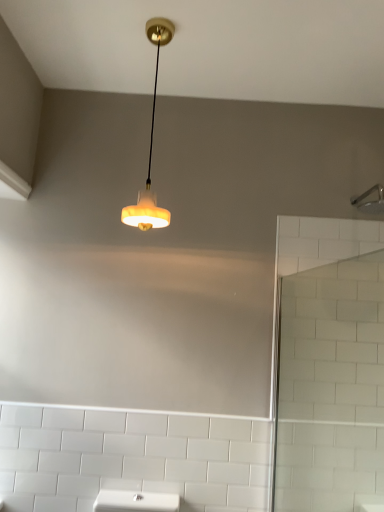
I want to click on silver metallic shower head at upper right, so click(x=370, y=201).

Does point (377, 213) lie behind point (151, 21)?

Yes.

Considering the relative sizes of silver metallic shower head at upper right and matte white lampshade at upper center in the image provided, is silver metallic shower head at upper right wider than matte white lampshade at upper center?

Yes, silver metallic shower head at upper right is wider than matte white lampshade at upper center.

Can you confirm if silver metallic shower head at upper right is positioned to the left of matte white lampshade at upper center?

In fact, silver metallic shower head at upper right is to the right of matte white lampshade at upper center.

Considering the relative sizes of matte white lampshade at upper center and white glass screen door at right in the image provided, is matte white lampshade at upper center shorter than white glass screen door at right?

Yes, matte white lampshade at upper center is shorter than white glass screen door at right.

The image size is (384, 512). Find the location of `lamp on the left of the white glass screen door at right`. lamp on the left of the white glass screen door at right is located at coordinates (151, 146).

Considering the positions of objects matte white lampshade at upper center and white glass screen door at right in the image provided, who is in front, matte white lampshade at upper center or white glass screen door at right?

white glass screen door at right is in front.

Is matte white lampshade at upper center beside white glass screen door at right?

No.

From a real-world perspective, is white glass screen door at right physically located above or below silver metallic shower head at upper right?

Clearly, from a real-world perspective, white glass screen door at right is below silver metallic shower head at upper right.

Is white glass screen door at right inside the boundaries of silver metallic shower head at upper right, or outside?

white glass screen door at right is not enclosed by silver metallic shower head at upper right.

From the picture: In terms of height, does white glass screen door at right look taller or shorter compared to silver metallic shower head at upper right?

Considering their sizes, white glass screen door at right has more height than silver metallic shower head at upper right.

Is white glass screen door at right positioned with its back to silver metallic shower head at upper right?

That's not correct — white glass screen door at right is not looking away from silver metallic shower head at upper right.

Is silver metallic shower head at upper right looking in the opposite direction of white glass screen door at right?

No.

From the image's perspective, is silver metallic shower head at upper right positioned above or below white glass screen door at right?

silver metallic shower head at upper right is above white glass screen door at right.

How far apart are silver metallic shower head at upper right and white glass screen door at right?

silver metallic shower head at upper right and white glass screen door at right are 27.37 inches apart.

From a real-world perspective, is silver metallic shower head at upper right physically above white glass screen door at right?

Correct, in the physical world, silver metallic shower head at upper right is higher than white glass screen door at right.

Is matte white lampshade at upper center shorter than silver metallic shower head at upper right?

No.

Is matte white lampshade at upper center closer to camera compared to silver metallic shower head at upper right?

That is True.

Does matte white lampshade at upper center have a greater width compared to silver metallic shower head at upper right?

No, matte white lampshade at upper center is not wider than silver metallic shower head at upper right.

From the image's perspective, is matte white lampshade at upper center located above silver metallic shower head at upper right?

Yes, from the image's perspective, matte white lampshade at upper center is on top of silver metallic shower head at upper right.

Based on the photo, would you consider white glass screen door at right to be distant from matte white lampshade at upper center?

That's right, there is a large distance between white glass screen door at right and matte white lampshade at upper center.

Is matte white lampshade at upper center a part of white glass screen door at right?

No, white glass screen door at right does not contain matte white lampshade at upper center.

From a real-world perspective, relative to matte white lampshade at upper center, is white glass screen door at right vertically above or below?

Clearly, from a real-world perspective, white glass screen door at right is below matte white lampshade at upper center.

Can you confirm if white glass screen door at right is wider than matte white lampshade at upper center?

Correct, the width of white glass screen door at right exceeds that of matte white lampshade at upper center.

Locate an element on the screen. lamp that is above the silver metallic shower head at upper right (from a real-world perspective) is located at coordinates (151, 146).

I want to click on lamp lying on the left of white glass screen door at right, so click(151, 146).

When comparing their distances from white glass screen door at right, does matte white lampshade at upper center or silver metallic shower head at upper right seem closer?

Among the two, silver metallic shower head at upper right is located nearer to white glass screen door at right.

Estimate the real-world distances between objects in this image. Which object is closer to silver metallic shower head at upper right, matte white lampshade at upper center or white glass screen door at right?

Based on the image, white glass screen door at right appears to be nearer to silver metallic shower head at upper right.

Considering their positions, is white glass screen door at right positioned further to silver metallic shower head at upper right than matte white lampshade at upper center?

The object further to silver metallic shower head at upper right is matte white lampshade at upper center.

From the image, which object appears to be farther from matte white lampshade at upper center, silver metallic shower head at upper right or white glass screen door at right?

white glass screen door at right.

Looking at this image, when comparing their distances from white glass screen door at right, does silver metallic shower head at upper right or matte white lampshade at upper center seem closer?

silver metallic shower head at upper right is closer to white glass screen door at right.

Based on their spatial positions, is white glass screen door at right or silver metallic shower head at upper right further from matte white lampshade at upper center?

white glass screen door at right.

The width and height of the screenshot is (384, 512). Identify the location of lamp between white glass screen door at right and silver metallic shower head at upper right along the z-axis. (151, 146).